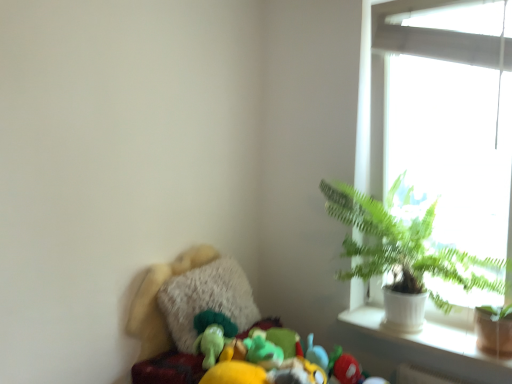
What do you see at coordinates (403, 247) in the screenshot?
I see `green leafy plant at upper right` at bounding box center [403, 247].

Describe the element at coordinates (452, 133) in the screenshot. The width and height of the screenshot is (512, 384). I see `white glass window at upper right` at that location.

Identify the location of green leafy plant at upper right. (403, 247).

Looking at this image, does white ceramic pot at upper right have a lesser width compared to white glass window at upper right?

No, white ceramic pot at upper right is not thinner than white glass window at upper right.

Which is closer to the camera, (421, 343) or (473, 237)?

The point (421, 343) is more forward.

Based on the photo, between white ceramic pot at upper right and white glass window at upper right, which one has more height?

white glass window at upper right.

Considering the relative positions of white ceramic pot at upper right and white glass window at upper right in the image provided, is white ceramic pot at upper right behind white glass window at upper right?

Yes, white ceramic pot at upper right is behind white glass window at upper right.

Is white glass window at upper right looking in the opposite direction of white ceramic pot at right?

No, white ceramic pot at right is not at the back of white glass window at upper right.

Between white glass window at upper right and white ceramic pot at right, which one has more height?

white glass window at upper right is taller.

Which is less distant, (392, 136) or (490, 315)?

The point (490, 315) is in front.

The width and height of the screenshot is (512, 384). Identify the location of window located on the left of white ceramic pot at right. (452, 133).

Does white ceramic pot at right have a lesser height compared to green leafy plant at upper right?

Yes.

Considering their positions, is white ceramic pot at right located in front of or behind green leafy plant at upper right?

Visually, white ceramic pot at right is located behind green leafy plant at upper right.

Is white ceramic pot at right facing towards green leafy plant at upper right?

Yes, white ceramic pot at right faces towards green leafy plant at upper right.

Does white ceramic pot at right contain green leafy plant at upper right?

No, white ceramic pot at right does not contain green leafy plant at upper right.

Is white glass window at upper right facing towards green leafy plant at upper right?

Yes, white glass window at upper right faces towards green leafy plant at upper right.

Is point (498, 178) farther from viewer compared to point (448, 275)?

Yes, it is behind point (448, 275).

Based on the photo, which of these two, white glass window at upper right or green leafy plant at upper right, is wider?

Wider between the two is green leafy plant at upper right.

From the image's perspective, which object appears higher, white glass window at upper right or green leafy plant at upper right?

white glass window at upper right is shown above in the image.

Consider the image. Is white glass window at upper right located within green leafy plant at upper right?

Absolutely, white glass window at upper right is inside green leafy plant at upper right.

Are green leafy plant at upper right and white glass window at upper right far apart?

No, green leafy plant at upper right is in close proximity to white glass window at upper right.

From a real-world perspective, who is located higher, green leafy plant at upper right or white glass window at upper right?

white glass window at upper right, from a real-world perspective.

From their relative heights in the image, would you say green leafy plant at upper right is taller or shorter than white glass window at upper right?

Clearly, green leafy plant at upper right is shorter compared to white glass window at upper right.

Is white glass window at upper right positioned in front of white ceramic pot at upper right?

That is True.

In order to click on window above the white ceramic pot at upper right (from a real-world perspective) in this screenshot , I will do `click(452, 133)`.

From a real-world perspective, is white glass window at upper right positioned above or below white ceramic pot at upper right?

In terms of real-world spatial position, white glass window at upper right is above white ceramic pot at upper right.

Considering the relative positions of white glass window at upper right and white ceramic pot at upper right in the image provided, is white glass window at upper right to the left or to the right of white ceramic pot at upper right?

Clearly, white glass window at upper right is on the right of white ceramic pot at upper right in the image.

Does white ceramic pot at right have a greater width compared to white glass window at upper right?

Yes, white ceramic pot at right is wider than white glass window at upper right.

Is white ceramic pot at right at the left side of white glass window at upper right?

In fact, white ceramic pot at right is to the right of white glass window at upper right.

From a real-world perspective, between white ceramic pot at right and white glass window at upper right, who is vertically lower?

white ceramic pot at right is physically lower.

Find the location of a particular element. window above the white ceramic pot at right (from the image's perspective) is located at coordinates (452, 133).

This screenshot has width=512, height=384. What are the coordinates of `window sill below the white glass window at upper right (from the image's perspective)` in the screenshot? It's located at (419, 344).

Where is `flowerpot beneath the white glass window at upper right (from a real-world perspective)`? The width and height of the screenshot is (512, 384). flowerpot beneath the white glass window at upper right (from a real-world perspective) is located at coordinates (493, 331).

Based on their spatial positions, is green leafy plant at upper right or white ceramic pot at right closer to white ceramic pot at upper right?

white ceramic pot at right is closer to white ceramic pot at upper right.

Considering their positions, is green leafy plant at upper right positioned closer to white ceramic pot at upper right than white glass window at upper right?

The object closer to white ceramic pot at upper right is green leafy plant at upper right.

Looking at the image, which one is located closer to white ceramic pot at right, white ceramic pot at upper right or green leafy plant at upper right?

white ceramic pot at upper right lies closer to white ceramic pot at right than the other object.

When comparing their distances from white ceramic pot at right, does white ceramic pot at upper right or white glass window at upper right seem further?

Among the two, white glass window at upper right is located further to white ceramic pot at right.

Looking at the image, which one is located closer to white ceramic pot at upper right, white ceramic pot at right or green leafy plant at upper right?

Based on the image, white ceramic pot at right appears to be nearer to white ceramic pot at upper right.

Based on their spatial positions, is white glass window at upper right or white ceramic pot at right further from white ceramic pot at upper right?

Based on the image, white glass window at upper right appears to be further to white ceramic pot at upper right.

Which object lies further to the anchor point green leafy plant at upper right, white glass window at upper right or white ceramic pot at right?

Answer: white ceramic pot at right is further to green leafy plant at upper right.

From the image, which object appears to be nearer to white ceramic pot at right, green leafy plant at upper right or white ceramic pot at upper right?

white ceramic pot at upper right is closer to white ceramic pot at right.

Identify the location of houseplant between white glass window at upper right and white ceramic pot at upper right in the up-down direction. Image resolution: width=512 pixels, height=384 pixels. (403, 247).

At what (x,y) coordinates should I click in order to perform the action: click on houseplant that lies between white glass window at upper right and white ceramic pot at right from top to bottom. Please return your answer as a coordinate pair (x, y). Looking at the image, I should click on (403, 247).

Identify the location of flowerpot between green leafy plant at upper right and white ceramic pot at upper right vertically. (493, 331).

Locate an element on the screen. flowerpot between white glass window at upper right and white ceramic pot at upper right vertically is located at coordinates (493, 331).